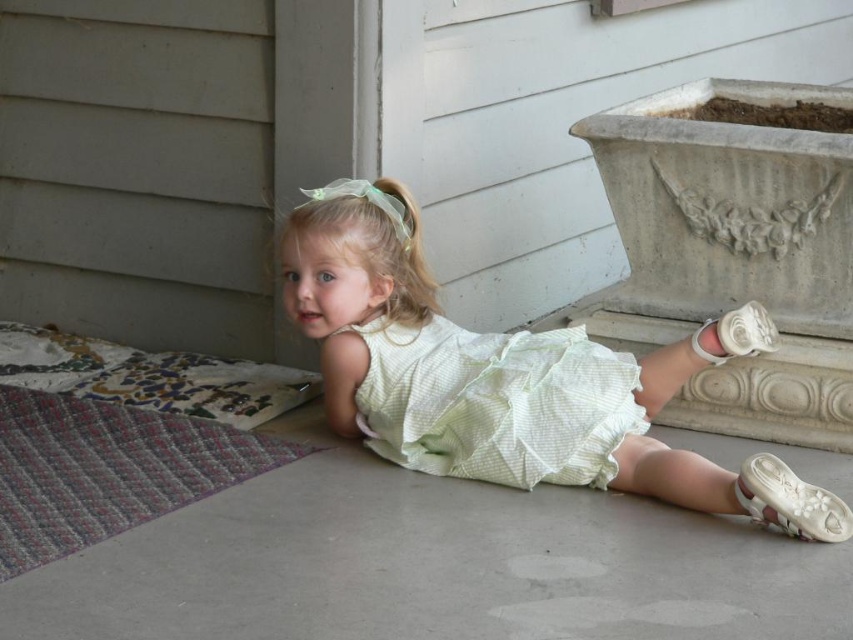
Can you confirm if light green textured dress at center is thinner than white satin shoe at lower right?

Incorrect, light green textured dress at center's width is not less than white satin shoe at lower right's.

Which is in front, point (453, 458) or point (743, 321)?

Point (453, 458)

Where is `light green textured dress at center`? light green textured dress at center is located at coordinates (496, 403).

Does light green fabric dress at center have a larger size compared to white satin shoe at lower right?

Yes.

Between point (331, 368) and point (730, 314), which one is positioned in front?

Positioned in front is point (331, 368).

The image size is (853, 640). In order to click on light green fabric dress at center in this screenshot , I will do 502,378.

Can you confirm if white smooth cement at lower center is thinner than light green fabric dress at center?

In fact, white smooth cement at lower center might be wider than light green fabric dress at center.

Where is `white smooth cement at lower center`? Image resolution: width=853 pixels, height=640 pixels. white smooth cement at lower center is located at coordinates (430, 564).

Locate an element on the screen. This screenshot has width=853, height=640. white smooth cement at lower center is located at coordinates (430, 564).